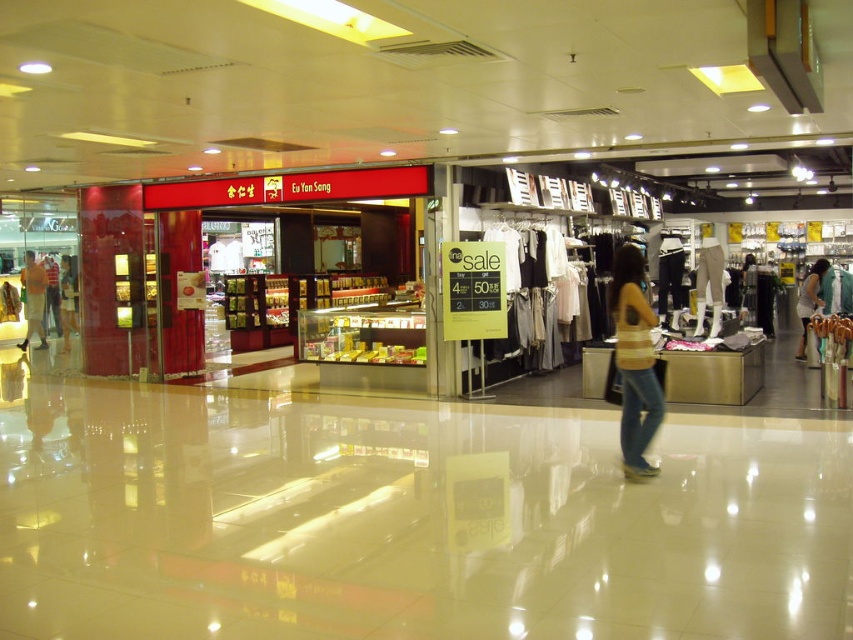
Does orange fabric shirt at left come behind matte black shirt at left?

Yes, it is.

Consider the image. Does orange fabric shirt at left have a greater width compared to matte black shirt at left?

Yes.

Is point (39, 310) farther from camera compared to point (61, 262)?

Yes, it is.

This screenshot has height=640, width=853. Identify the location of orange fabric shirt at left. (33, 300).

Which is in front, point (635, 372) or point (44, 272)?

Positioned in front is point (635, 372).

Is striped jersey at center positioned in front of orange fabric shirt at left?

Yes, it is.

Image resolution: width=853 pixels, height=640 pixels. What do you see at coordinates (634, 362) in the screenshot? I see `striped jersey at center` at bounding box center [634, 362].

Find the location of a particular element. striped jersey at center is located at coordinates (634, 362).

Find the location of a particular element. The image size is (853, 640). striped jersey at center is located at coordinates (634, 362).

Between striped jersey at center and light beige fabric dress at center, which one appears on the left side from the viewer's perspective?

striped jersey at center

The image size is (853, 640). I want to click on striped jersey at center, so click(x=634, y=362).